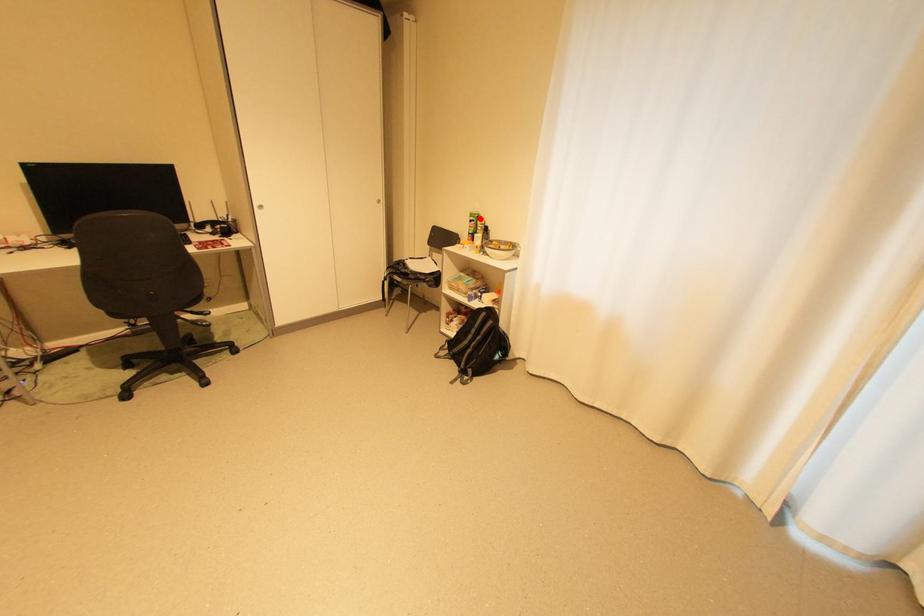
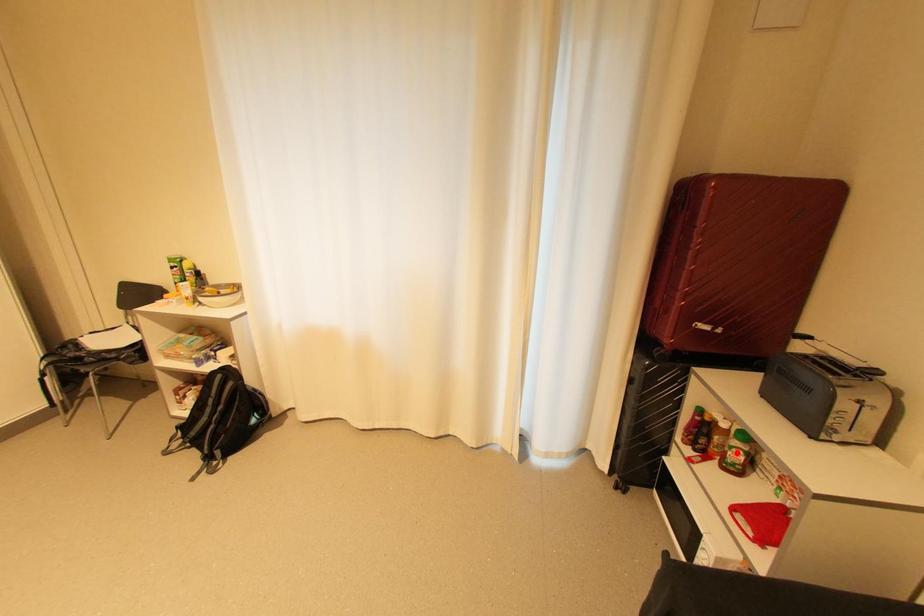
I am providing you with two images of the same scene from different viewpoints. A red point is marked on the first image and another point is marked on the second image. Is the red point in image1 aligned with the point shown in image2?

No